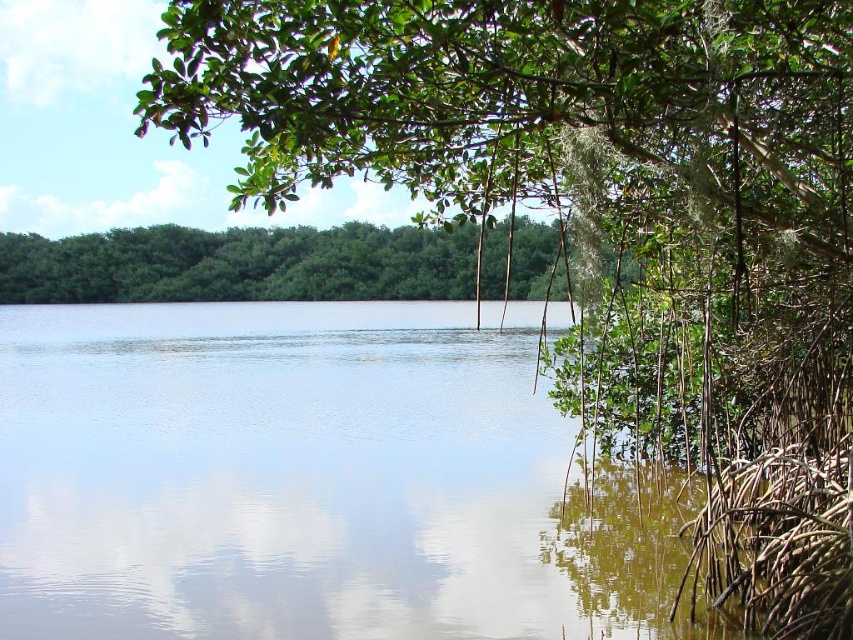
You are standing on a wooden pier observing the scene. You notice the clear water at center and the green leafy trees at center. Which object is closer to you?

The clear water at center is closer to you because the green leafy trees at center are positioned behind it.

You are an environmental scientist assessing the health of this water body. You observe the clear water at center and the green leafy trees at center. Which of these two elements occupies a larger area in the scene?

The clear water at center is larger in size than the green leafy trees at center, so the clear water at center occupies a larger area in the scene.